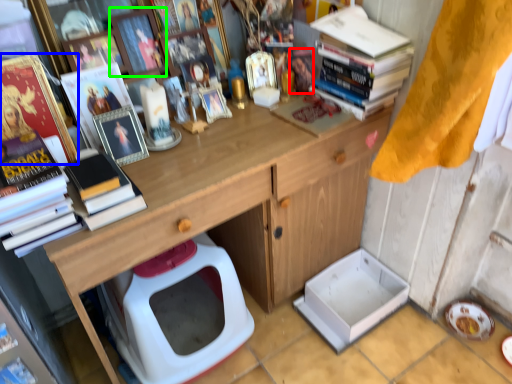
Question: Based on their relative distances, which object is farther from toy (highlighted by a red box)? Choose from book (highlighted by a blue box) and picture frame (highlighted by a green box).

Choices:
 (A) book
 (B) picture frame

Answer: (A)